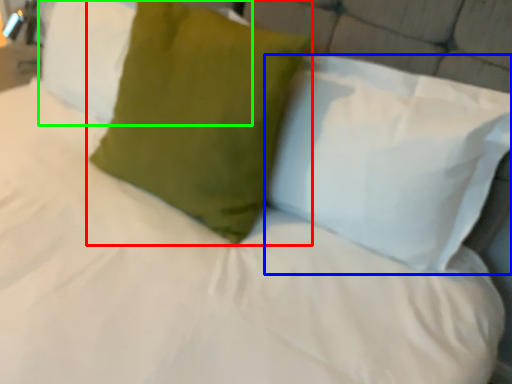
Question: Which is nearer to the pillow (highlighted by a red box)? pillow (highlighted by a blue box) or pillow (highlighted by a green box).

Choices:
 (A) pillow
 (B) pillow

Answer: (A)